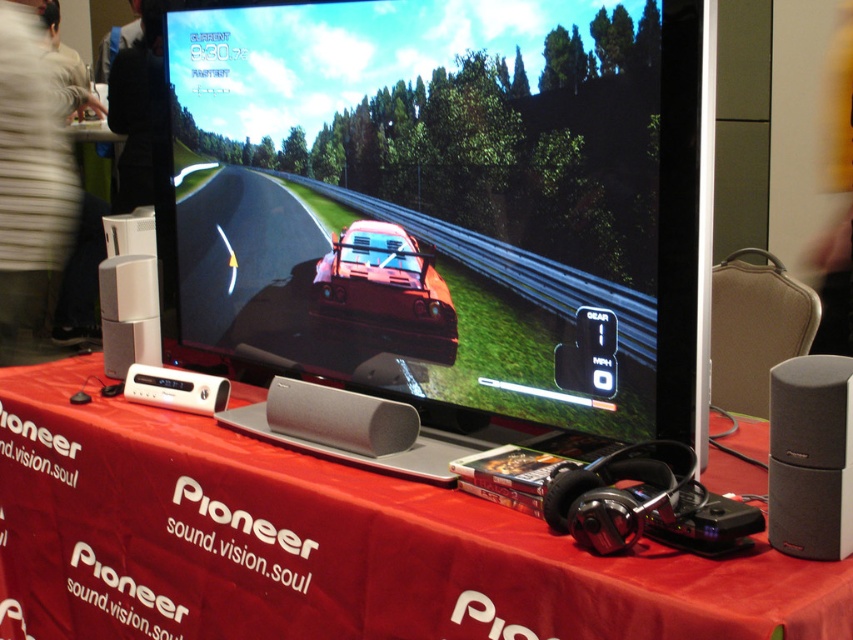
Describe the element at coordinates (810, 458) in the screenshot. I see `black matte speaker at right` at that location.

Is black matte speaker at right wider than shiny orange car at center?

No.

Which is behind, point (775, 451) or point (399, 276)?

The point (399, 276) is more distant.

Identify the location of black matte speaker at right. This screenshot has height=640, width=853. (810, 458).

Which is behind, point (590, 568) or point (109, 362)?

Positioned behind is point (109, 362).

Locate an element on the screen. The image size is (853, 640). red fabric table at center is located at coordinates (323, 545).

Who is more distant from viewer, (x=637, y=609) or (x=146, y=326)?

Positioned behind is point (x=146, y=326).

Locate an element on the screen. red fabric table at center is located at coordinates (323, 545).

Is point (300, 301) behind point (22, 51)?

No, it is in front of (22, 51).

Can you confirm if shiny black monitor at center is smaller than white striped shirt at upper left?

Correct, shiny black monitor at center occupies less space than white striped shirt at upper left.

Is point (216, 131) farther from camera compared to point (22, 8)?

That is False.

Where is `shiny black monitor at center`? The height and width of the screenshot is (640, 853). shiny black monitor at center is located at coordinates (424, 202).